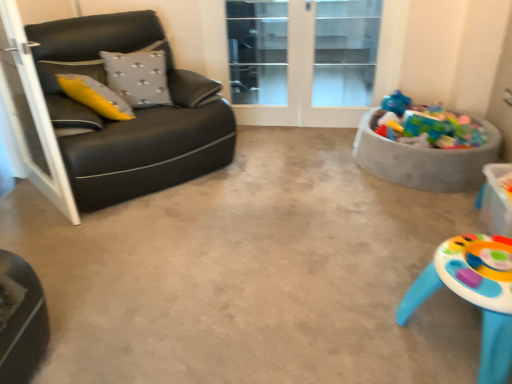
Where is `vacant space positioned to the left of matte plastic table at lower right`? The width and height of the screenshot is (512, 384). vacant space positioned to the left of matte plastic table at lower right is located at coordinates (335, 315).